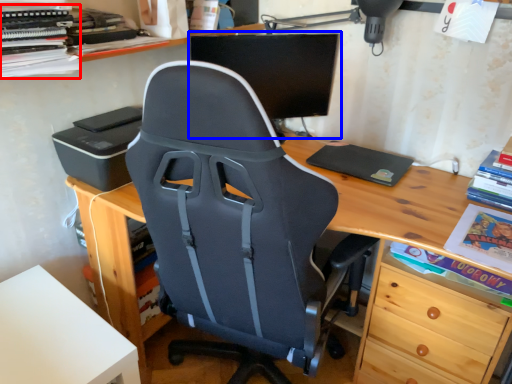
Question: Which object appears closest to the camera in this image, book (highlighted by a red box) or computer monitor (highlighted by a blue box)?

Choices:
 (A) book
 (B) computer monitor

Answer: (A)